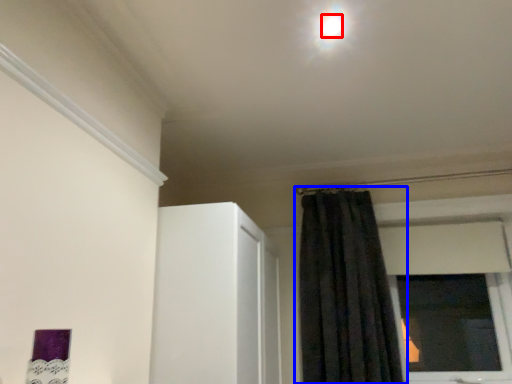
Question: Which of the following is the farthest to the observer, light (highlighted by a red box) or curtain (highlighted by a blue box)?

Choices:
 (A) light
 (B) curtain

Answer: (B)